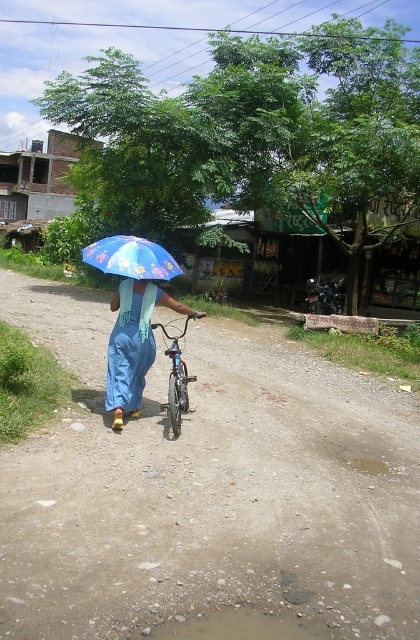
Can you confirm if blue fabric umbrella at center is positioned to the right of shiny metallic bicycle at center?

In fact, blue fabric umbrella at center is to the left of shiny metallic bicycle at center.

Between blue fabric umbrella at center and shiny metallic bicycle at center, which one has more height?

With more height is blue fabric umbrella at center.

Between point (136, 413) and point (178, 339), which one is positioned in front?

Point (136, 413) is in front.

Identify the location of blue fabric umbrella at center. The width and height of the screenshot is (420, 640). (133, 344).

Is blue fabric umbrella at center positioned in front of blue printed umbrella at center?

No, blue fabric umbrella at center is behind blue printed umbrella at center.

Can you confirm if blue fabric umbrella at center is bigger than blue printed umbrella at center?

No, blue fabric umbrella at center is not bigger than blue printed umbrella at center.

Does point (121, 358) come farther from viewer compared to point (109, 257)?

Yes, point (121, 358) is farther from viewer.

Identify the location of blue fabric umbrella at center. The width and height of the screenshot is (420, 640). (133, 344).

Does blue printed umbrella at center appear over shiny metallic bicycle at center?

Yes, blue printed umbrella at center is above shiny metallic bicycle at center.

This screenshot has width=420, height=640. I want to click on blue printed umbrella at center, so click(131, 257).